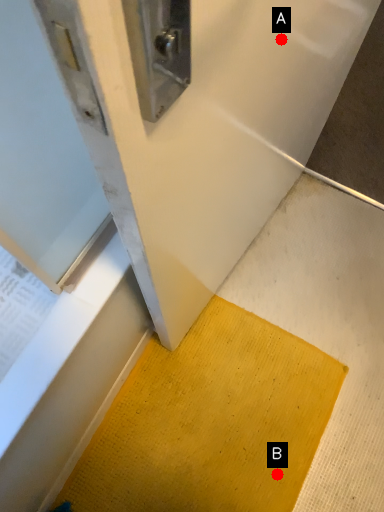
Question: Two points are circled on the image, labeled by A and B beside each circle. Which point appears closest to the camera in this image?

Choices:
 (A) A is closer
 (B) B is closer

Answer: (A)